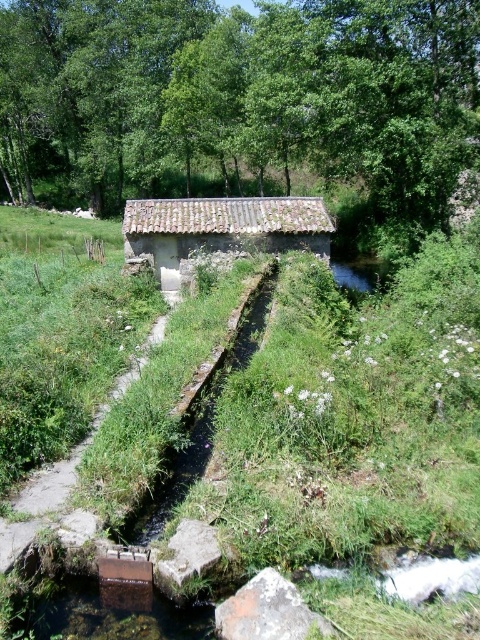
Question: Can you confirm if rusty metal hut at center is positioned below brown concrete trench at center?

Choices:
 (A) no
 (B) yes

Answer: (A)

Question: From the image, what is the correct spatial relationship of rusty metal hut at center in relation to brown concrete trench at center?

Choices:
 (A) right
 (B) left

Answer: (B)

Question: Which of the following is the closest to the observer?

Choices:
 (A) (276, 269)
 (B) (224, 250)

Answer: (A)

Question: Is rusty metal hut at center to the right of brown concrete trench at center from the viewer's perspective?

Choices:
 (A) yes
 (B) no

Answer: (B)